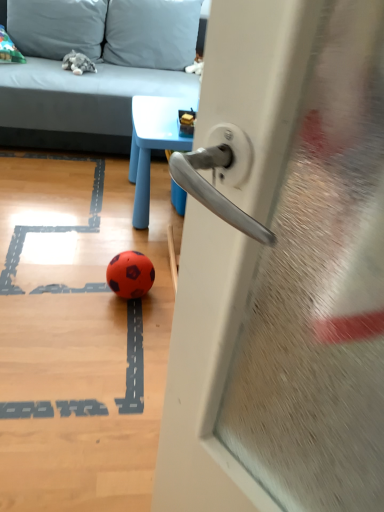
Question: Is gray fabric couch at upper left situated inside rubber soccer ball at center or outside?

Choices:
 (A) inside
 (B) outside

Answer: (B)

Question: Is gray fabric couch at upper left to the left or to the right of rubber soccer ball at center in the image?

Choices:
 (A) left
 (B) right

Answer: (A)

Question: Considering the real-world distances, which object is farthest from the gray plush toy at upper left?

Choices:
 (A) gray fabric couch at upper left
 (B) rubber soccer ball at center
 (C) soft gray pillow at upper left, acting as the second pillow starting from the right
 (D) soft gray pillow at upper center, which is the second pillow from left to right
 (E) metallic silver handle at center

Answer: (E)

Question: Which of these objects is positioned farthest from the blue plastic table at upper center?

Choices:
 (A) soft gray pillow at upper left, arranged as the first pillow when viewed from the left
 (B) gray plush toy at upper left
 (C) rubber soccer ball at center
 (D) gray fabric couch at upper left
 (E) metallic silver handle at center

Answer: (E)